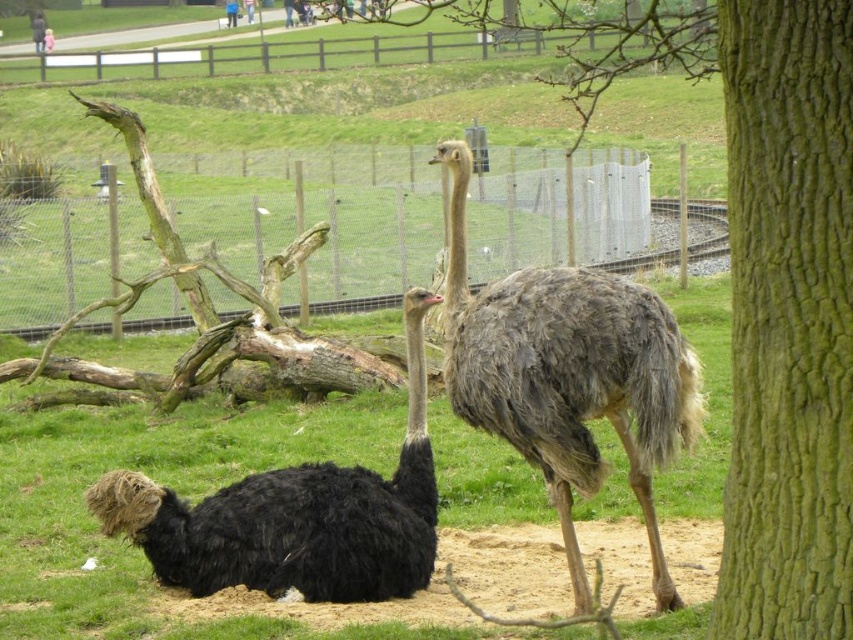
Is point (788, 518) positioned in front of point (549, 516)?

Yes, it is in front of point (549, 516).

Is green rough bark tree at center right taller than green grass at center?

Indeed, green rough bark tree at center right has a greater height compared to green grass at center.

What do you see at coordinates (769, 285) in the screenshot? I see `green rough bark tree at center right` at bounding box center [769, 285].

Locate an element on the screen. green rough bark tree at center right is located at coordinates (769, 285).

Is the position of green rough bark tree trunk at right less distant than that of brown feathered ostrich at center?

That is True.

Which is more to the right, green rough bark tree trunk at right or brown feathered ostrich at center?

green rough bark tree trunk at right

You are a GUI agent. You are given a task and a screenshot of the screen. Output one action in this format:
    pyautogui.click(x=<x>, y=<y>)
    Task: Click on the green rough bark tree trunk at right
    This screenshot has height=640, width=853.
    Given the screenshot: What is the action you would take?
    pyautogui.click(x=788, y=320)

Is metallic wire fence at upper center to the right of black feathered ostrich at lower left from the viewer's perspective?

In fact, metallic wire fence at upper center is to the left of black feathered ostrich at lower left.

Can you confirm if metallic wire fence at upper center is wider than black feathered ostrich at lower left?

Yes, metallic wire fence at upper center is wider than black feathered ostrich at lower left.

Does point (277, 205) come behind point (422, 536)?

Yes, it is behind point (422, 536).

You are a GUI agent. You are given a task and a screenshot of the screen. Output one action in this format:
    pyautogui.click(x=<x>, y=<y>)
    Task: Click on the metallic wire fence at upper center
    
    Given the screenshot: What is the action you would take?
    pyautogui.click(x=370, y=243)